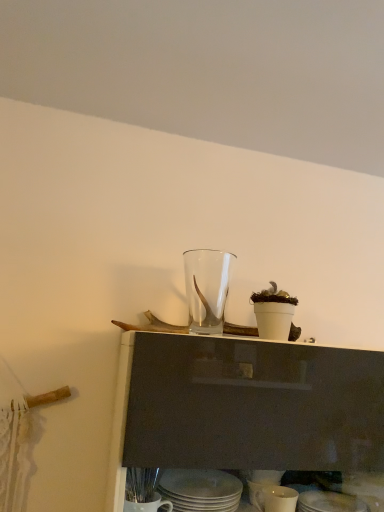
Question: From the image's perspective, is white ceramic plates at lower center, which appears as the second tableware when viewed from the top, on top of transparent glass vase at center, arranged as the 1th tableware when viewed from the top?

Choices:
 (A) no
 (B) yes

Answer: (A)

Question: Is white ceramic plates at lower center, which appears as the second tableware when viewed from the top, located outside transparent glass vase at center, which is the fourth tableware in bottom-to-top order?

Choices:
 (A) no
 (B) yes

Answer: (B)

Question: Does white ceramic plates at lower center, which appears as the second tableware when viewed from the top, have a smaller size compared to transparent glass vase at center, arranged as the 1th tableware when viewed from the top?

Choices:
 (A) yes
 (B) no

Answer: (A)

Question: Is white ceramic plates at lower center, which appears as the second tableware when viewed from the top, positioned in front of transparent glass vase at center, which is the fourth tableware in bottom-to-top order?

Choices:
 (A) yes
 (B) no

Answer: (A)

Question: Is white ceramic plates at lower center, which appears as the second tableware when viewed from the top, next to transparent glass vase at center, arranged as the 1th tableware when viewed from the top, and touching it?

Choices:
 (A) no
 (B) yes

Answer: (A)

Question: Considering the positions of white glossy mug at lower center, arranged as the 3th tableware when viewed from the top, and matte white plate at lower center, which ranks as the fourth tableware in top-to-bottom order, in the image, is white glossy mug at lower center, arranged as the 3th tableware when viewed from the top, wider or thinner than matte white plate at lower center, which ranks as the fourth tableware in top-to-bottom order,?

Choices:
 (A) thin
 (B) wide

Answer: (B)

Question: Which is correct: white glossy mug at lower center, acting as the 2th tableware starting from the bottom, is inside matte white plate at lower center, which ranks as the fourth tableware in top-to-bottom order, or outside of it?

Choices:
 (A) outside
 (B) inside

Answer: (A)

Question: Is white glossy mug at lower center, arranged as the 3th tableware when viewed from the top, to the left or to the right of matte white plate at lower center, which ranks as the fourth tableware in top-to-bottom order, in the image?

Choices:
 (A) right
 (B) left

Answer: (B)

Question: Considering the positions of white glossy mug at lower center, acting as the 2th tableware starting from the bottom, and matte white plate at lower center, which appears as the first tableware when ordered from the bottom, in the image, is white glossy mug at lower center, acting as the 2th tableware starting from the bottom, taller or shorter than matte white plate at lower center, which appears as the first tableware when ordered from the bottom,?

Choices:
 (A) tall
 (B) short

Answer: (A)

Question: From the image's perspective, is white glossy mug at lower center, arranged as the 3th tableware when viewed from the top, above or below transparent glass vase at center, arranged as the 1th tableware when viewed from the top?

Choices:
 (A) below
 (B) above

Answer: (A)

Question: Considering the positions of point (256, 504) and point (208, 333), is point (256, 504) closer or farther from the camera than point (208, 333)?

Choices:
 (A) farther
 (B) closer

Answer: (A)

Question: In the image, is white glossy mug at lower center, arranged as the 3th tableware when viewed from the top, on the left side or the right side of transparent glass vase at center, which is the fourth tableware in bottom-to-top order?

Choices:
 (A) right
 (B) left

Answer: (A)

Question: Looking at their shapes, would you say white glossy mug at lower center, arranged as the 3th tableware when viewed from the top, is wider or thinner than transparent glass vase at center, which is the fourth tableware in bottom-to-top order?

Choices:
 (A) wide
 (B) thin

Answer: (B)

Question: Does point (336, 508) appear closer or farther from the camera than point (193, 484)?

Choices:
 (A) farther
 (B) closer

Answer: (B)

Question: Would you say matte white plate at lower center, which ranks as the fourth tableware in top-to-bottom order, is inside or outside white ceramic plates at lower center, which appears as the second tableware when viewed from the top?

Choices:
 (A) inside
 (B) outside

Answer: (B)